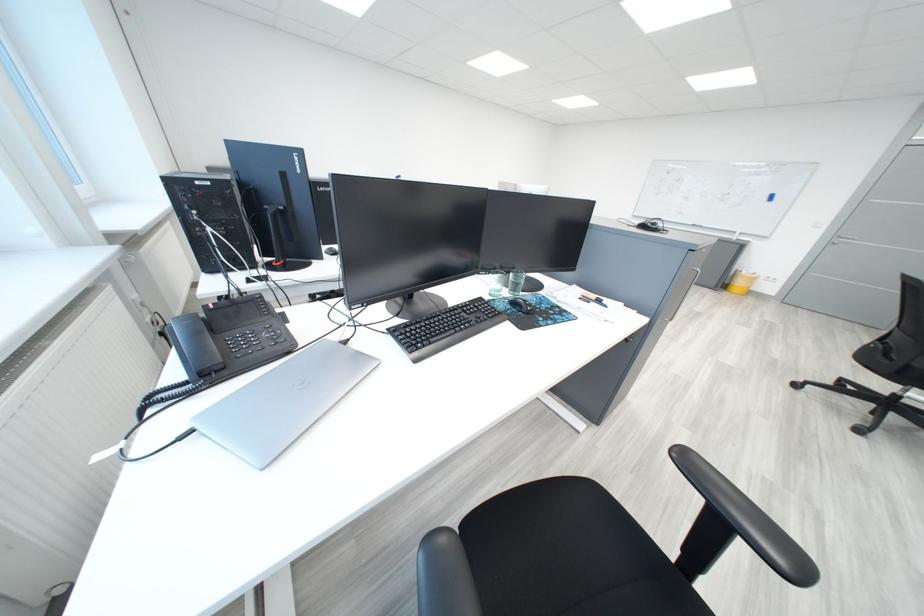
Find where to lift the glass cup. Please return your answer as a coordinate pair (x, y).

(495, 283)